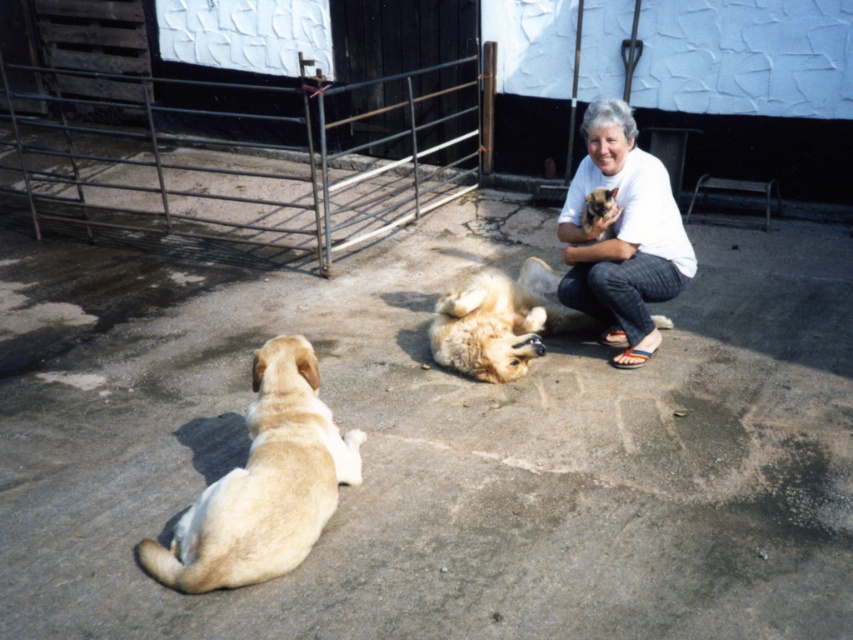
You are a drone operator trying to capture a photo of the light brown fur at lower left from above. The drone can only hover up to 3 meters away from the subject. Can the drone successfully capture the photo?

The distance between the light brown fur at lower left and the viewer is 2.72 meters, which is within the drone operator s 3 meter limit. The drone can successfully capture the photo.

In the image, there are two dogs and a woman. The woman is holding a small puppy. The light brown fur at lower left is located at point (264, 483). Can you tell me where the light brown fur at lower left is located in the image?

The light brown fur at lower left is located at point (264, 483).

You are a photographer trying to capture a photo of both the light brown fur at lower left and the white cotton shirt at upper right. Which object should you focus on first to ensure both are in focus?

You should focus on the light brown fur at lower left first because it is closer to the viewer than the white cotton shirt at upper right, so adjusting focus from near to far will help both be in focus.